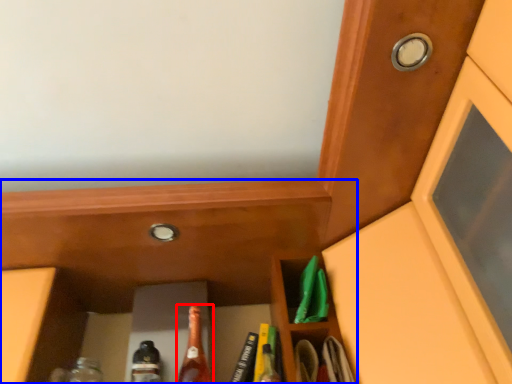
Question: Which object appears closest to the camera in this image, beer bottle (highlighted by a red box) or cabinetry (highlighted by a blue box)?

Choices:
 (A) beer bottle
 (B) cabinetry

Answer: (B)